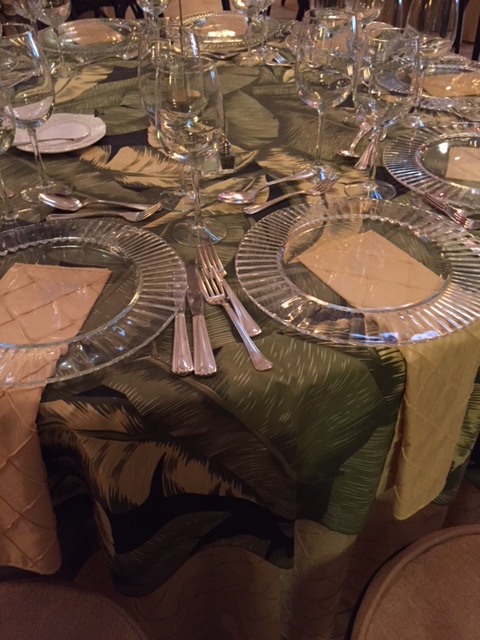
Identify the location of glass, wine glass. (39, 86), (196, 137), (146, 50), (339, 64), (391, 91), (361, 9), (54, 13), (150, 6), (254, 3).